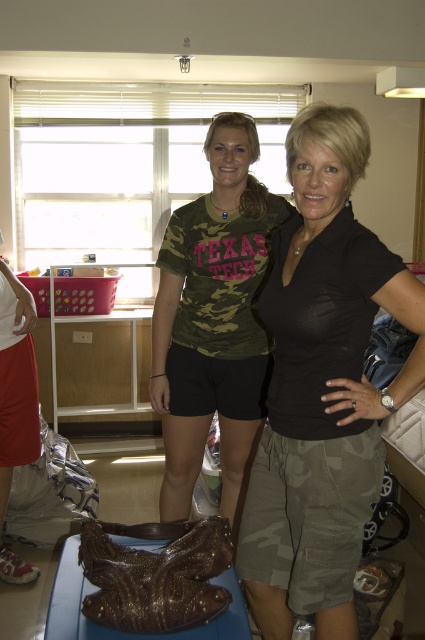
Who is positioned more to the left, camo fabric shirt at center or shiny metallic shoe at lower left?

Positioned to the left is shiny metallic shoe at lower left.

Between camo fabric shirt at center and shiny metallic shoe at lower left, which one has less height?

With less height is shiny metallic shoe at lower left.

Is point (249, 310) positioned behind point (19, 362)?

No, (249, 310) is in front of (19, 362).

Find the location of a particular element. The image size is (425, 640). camo fabric shirt at center is located at coordinates (214, 321).

Is matte black shirt at center positioned in front of camo fabric shirt at center?

Yes, it is in front of camo fabric shirt at center.

Which is behind, point (295, 524) or point (201, 202)?

The point (201, 202) is more distant.

The height and width of the screenshot is (640, 425). What are the coordinates of `matte black shirt at center` in the screenshot? It's located at (322, 387).

Is matte black shirt at center below shiny metallic shoe at lower left?

Actually, matte black shirt at center is above shiny metallic shoe at lower left.

Does matte black shirt at center appear over shiny metallic shoe at lower left?

Yes.

Is point (277, 545) closer to camera compared to point (22, 436)?

That is True.

The width and height of the screenshot is (425, 640). What are the coordinates of `matte black shirt at center` in the screenshot? It's located at (322, 387).